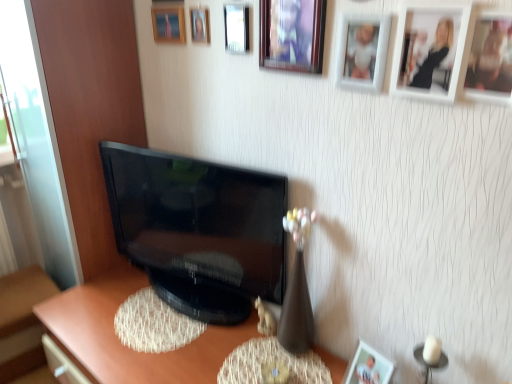
Question: Should I look upward or downward to see matte brown desk at center?

Choices:
 (A) down
 (B) up

Answer: (A)

Question: From the image's perspective, is matte brown desk at center beneath black glossy television at center?

Choices:
 (A) no
 (B) yes

Answer: (B)

Question: Is matte brown desk at center beside black glossy television at center?

Choices:
 (A) yes
 (B) no

Answer: (B)

Question: From the image's perspective, is matte brown desk at center over black glossy television at center?

Choices:
 (A) no
 (B) yes

Answer: (A)

Question: Could you tell me if matte brown desk at center is turned towards black glossy television at center?

Choices:
 (A) no
 (B) yes

Answer: (A)

Question: From a real-world perspective, is matte brown desk at center over black glossy television at center?

Choices:
 (A) yes
 (B) no

Answer: (B)

Question: Is matte brown desk at center behind black glossy television at center?

Choices:
 (A) yes
 (B) no

Answer: (B)

Question: From a real-world perspective, is matte white picture frame at lower right, marked as the 8th picture frame in a top-to-bottom arrangement, under black glossy television at center?

Choices:
 (A) yes
 (B) no

Answer: (A)

Question: Is matte white picture frame at lower right, the 1th picture frame positioned from the bottom, completely or partially outside of black glossy television at center?

Choices:
 (A) no
 (B) yes

Answer: (B)

Question: Are matte white picture frame at lower right, the 1th picture frame positioned from the bottom, and black glossy television at center located far from each other?

Choices:
 (A) no
 (B) yes

Answer: (A)

Question: From the image's perspective, is matte white picture frame at lower right, marked as the 8th picture frame in a top-to-bottom arrangement, beneath black glossy television at center?

Choices:
 (A) yes
 (B) no

Answer: (A)

Question: Is matte white picture frame at lower right, the 3th picture frame positioned from the right, behind black glossy television at center?

Choices:
 (A) no
 (B) yes

Answer: (A)

Question: Can you confirm if matte white picture frame at lower right, the 3th picture frame positioned from the right, is smaller than black glossy television at center?

Choices:
 (A) no
 (B) yes

Answer: (B)

Question: From the image's perspective, is white plastic dog at lower center on wooden photo frame at upper right, which is the 7th picture frame from top to bottom?

Choices:
 (A) no
 (B) yes

Answer: (A)